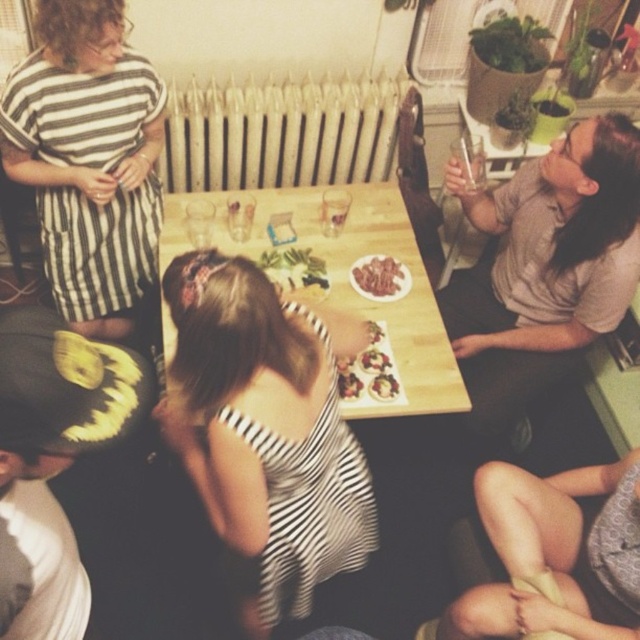
What is located at the coordinates point (554, 552) in the image?

The point (554, 552) indicates skinny jeans at lower right.

You are a photographer setting up a shot of the scene. You want to ensure both the gray cotton shirt at upper right and the black matte pumpkin at lower left are clearly visible. Considering their sizes, which object should you focus on first to ensure depth of field captures both?

The gray cotton shirt at upper right is larger than the black matte pumpkin at lower left, so focusing on the larger gray cotton shirt at upper right first will help ensure both are in focus through depth of field.